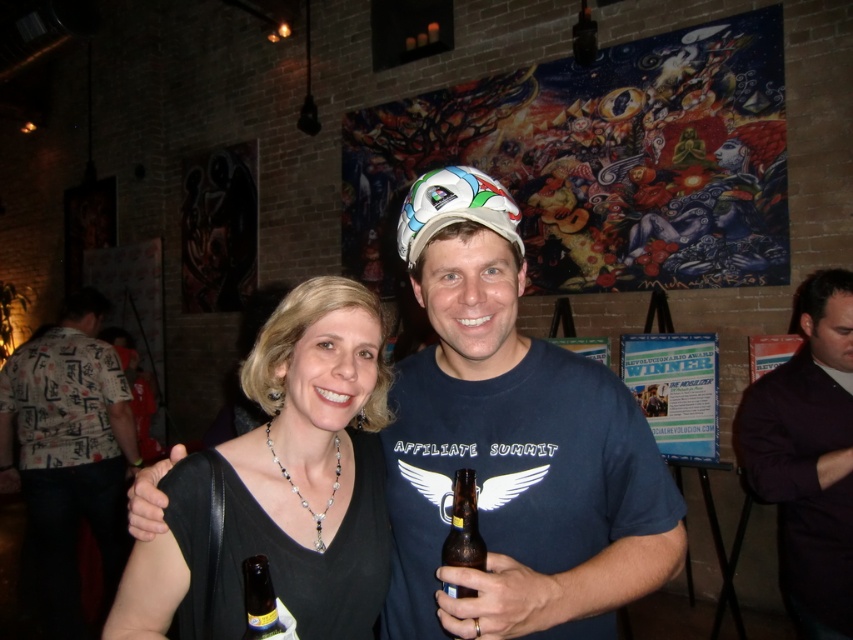
Question: In this image, where is black matte dress at center located relative to dark purple shirt at right?

Choices:
 (A) right
 (B) left

Answer: (B)

Question: Which of the following is the farthest from the observer?

Choices:
 (A) brown glass bottle at center
 (B) white printed shirt at left
 (C) dark purple shirt at right
 (D) brown glass bottle at lower left

Answer: (B)

Question: Which of the following is the closest to the observer?

Choices:
 (A) matte blue t-shirt at center
 (B) brown glass bottle at lower left
 (C) white printed shirt at left
 (D) brown glass bottle at center

Answer: (B)

Question: Is dark purple shirt at right closer to the viewer compared to brown glass bottle at center?

Choices:
 (A) no
 (B) yes

Answer: (A)

Question: Can you confirm if brown glass bottle at center is positioned above brown glass bottle at lower left?

Choices:
 (A) no
 (B) yes

Answer: (B)

Question: Which point is farther to the camera?

Choices:
 (A) black matte dress at center
 (B) white printed shirt at left
 (C) brown glass bottle at lower left

Answer: (B)